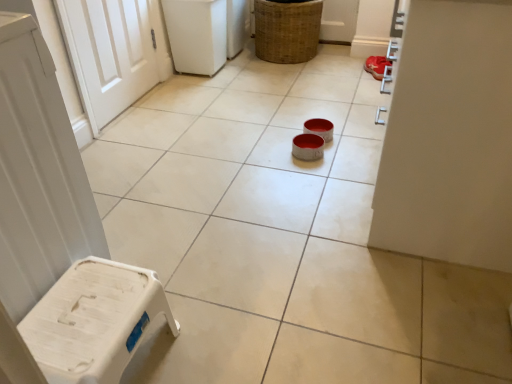
Question: Considering the relative sizes of woven brown basket at upper center and white plastic stool at lower left in the image provided, is woven brown basket at upper center shorter than white plastic stool at lower left?

Choices:
 (A) no
 (B) yes

Answer: (A)

Question: From the image's perspective, is woven brown basket at upper center beneath white plastic stool at lower left?

Choices:
 (A) yes
 (B) no

Answer: (B)

Question: Does woven brown basket at upper center appear on the left side of white plastic stool at lower left?

Choices:
 (A) yes
 (B) no

Answer: (B)

Question: Does woven brown basket at upper center turn towards white plastic stool at lower left?

Choices:
 (A) no
 (B) yes

Answer: (B)

Question: Is woven brown basket at upper center taller than white plastic stool at lower left?

Choices:
 (A) no
 (B) yes

Answer: (B)

Question: Considering the positions of woven brown basket at upper center and red suede shoe at upper right in the image, is woven brown basket at upper center taller or shorter than red suede shoe at upper right?

Choices:
 (A) tall
 (B) short

Answer: (A)

Question: Relative to red suede shoe at upper right, is woven brown basket at upper center in front or behind?

Choices:
 (A) behind
 (B) front

Answer: (B)

Question: Which is correct: woven brown basket at upper center is inside red suede shoe at upper right, or outside of it?

Choices:
 (A) inside
 (B) outside

Answer: (B)

Question: From a real-world perspective, relative to red suede shoe at upper right, is woven brown basket at upper center vertically above or below?

Choices:
 (A) above
 (B) below

Answer: (A)

Question: From the image's perspective, is red suede shoe at upper right above or below woven brown basket at upper center?

Choices:
 (A) above
 (B) below

Answer: (B)

Question: Considering the positions of red suede shoe at upper right and woven brown basket at upper center in the image, is red suede shoe at upper right bigger or smaller than woven brown basket at upper center?

Choices:
 (A) big
 (B) small

Answer: (B)

Question: Is red suede shoe at upper right in front of or behind woven brown basket at upper center in the image?

Choices:
 (A) behind
 (B) front

Answer: (A)

Question: Is point (375, 77) positioned closer to the camera than point (304, 26)?

Choices:
 (A) farther
 (B) closer

Answer: (B)

Question: From their relative heights in the image, would you say woven brown basket at upper center is taller or shorter than white plastic stool at lower left?

Choices:
 (A) short
 (B) tall

Answer: (B)

Question: Is woven brown basket at upper center bigger or smaller than white plastic stool at lower left?

Choices:
 (A) big
 (B) small

Answer: (A)